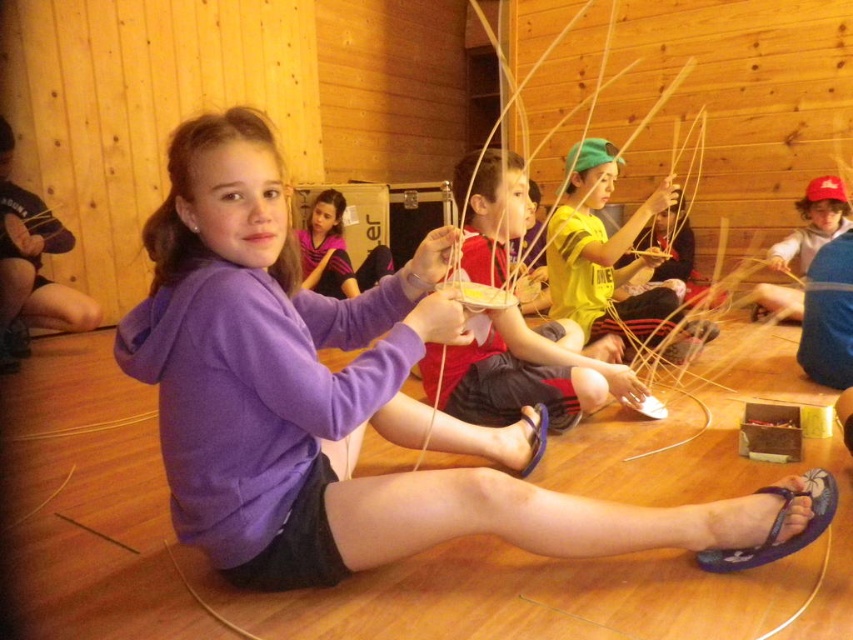
The height and width of the screenshot is (640, 853). What do you see at coordinates (780, 525) in the screenshot?
I see `blue fabric sandal at lower right` at bounding box center [780, 525].

Which is below, blue fabric sandal at lower right or purple fabric sandal at lower center?

blue fabric sandal at lower right is lower down.

Between point (746, 552) and point (543, 406), which one is positioned behind?

Point (543, 406)

Where is `blue fabric sandal at lower right`? This screenshot has width=853, height=640. blue fabric sandal at lower right is located at coordinates (780, 525).

Is point (415, 320) farther from camera compared to point (714, 561)?

No, (415, 320) is in front of (714, 561).

Find the location of `purple cotton hoodie at center`. purple cotton hoodie at center is located at coordinates (332, 397).

Is point (281, 284) positioned behind point (820, 524)?

Yes.

Where is `purple cotton hoodie at center`? purple cotton hoodie at center is located at coordinates (332, 397).

Is matte blue hoodie at center in front of blue fabric sandal at lower right?

No, it is not.

I want to click on matte blue hoodie at center, so click(813, 224).

Where is `matte blue hoodie at center`? The image size is (853, 640). matte blue hoodie at center is located at coordinates (813, 224).